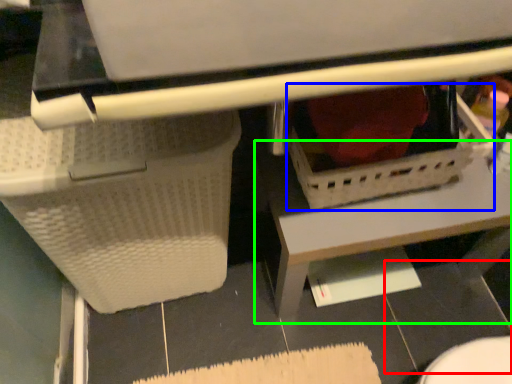
Question: Considering the real-world distances, which object is farthest from tile (highlighted by a red box)? basket (highlighted by a blue box) or table (highlighted by a green box)?

Choices:
 (A) basket
 (B) table

Answer: (A)